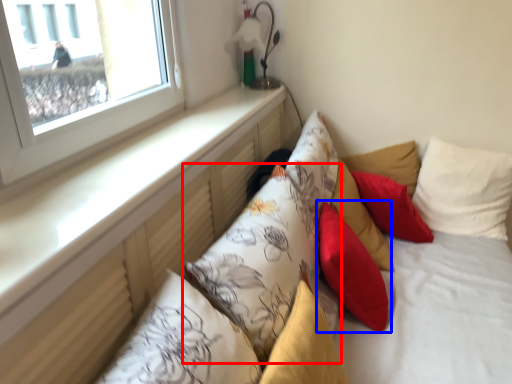
Question: Which of the following is the farthest to the observer, pillow (highlighted by a red box) or pillow (highlighted by a blue box)?

Choices:
 (A) pillow
 (B) pillow

Answer: (B)